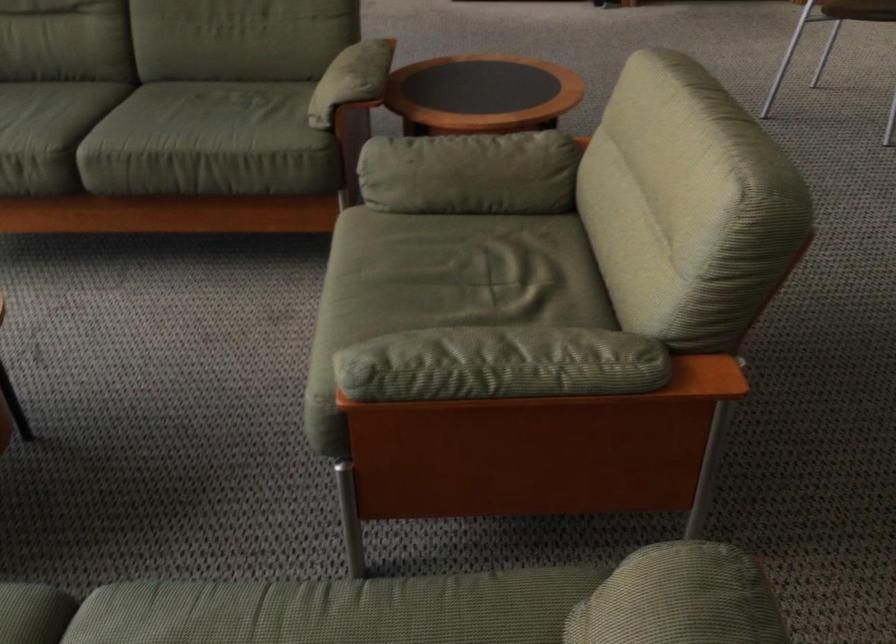
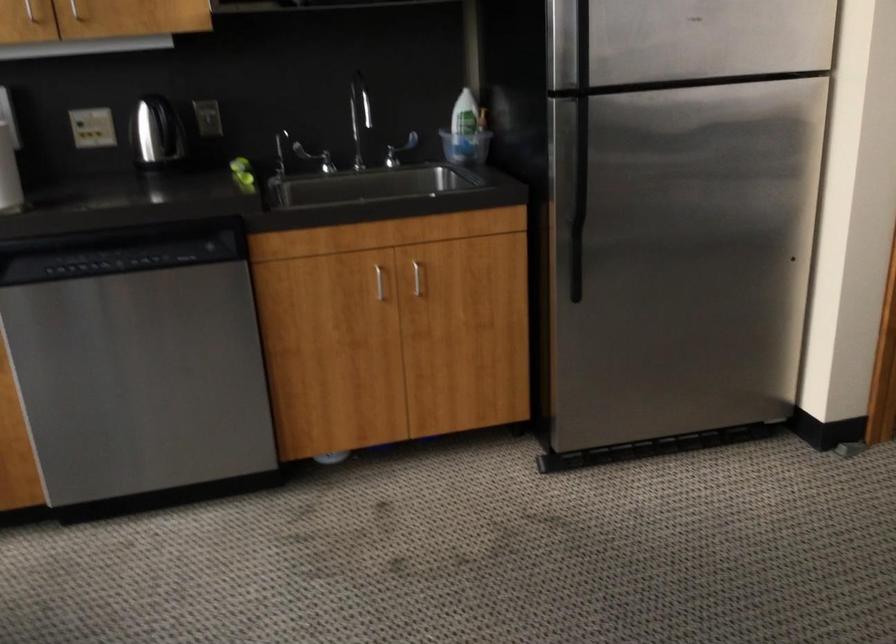
Question: What movement of the cameraman would produce the second image?

Choices:
 (A) Left
 (B) Right
 (C) Forward
 (D) Backward

Answer: (C)